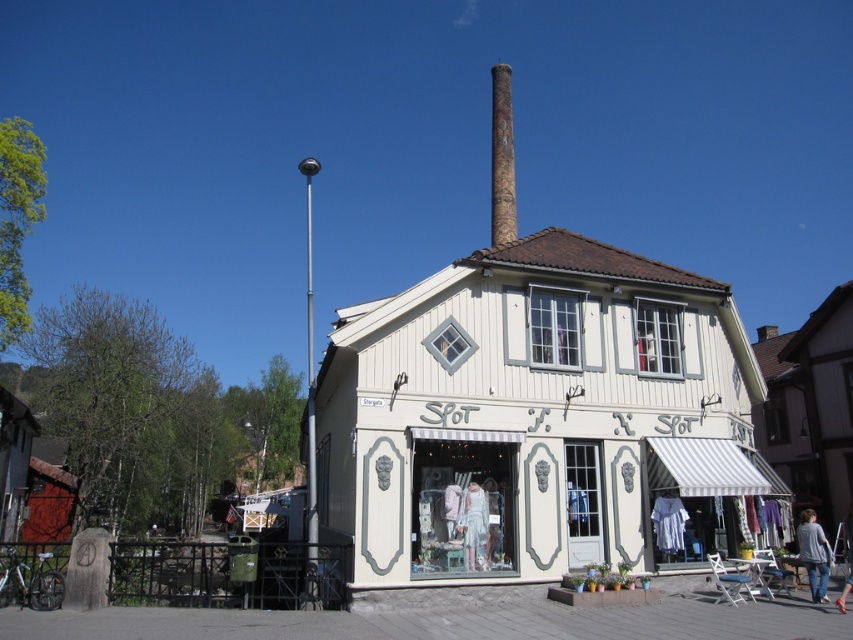
Does white wood storefront at center appear over gray sweater at lower right?

Yes, white wood storefront at center is above gray sweater at lower right.

Can you confirm if white wood storefront at center is taller than gray sweater at lower right?

Indeed, white wood storefront at center has a greater height compared to gray sweater at lower right.

Which is in front, point (322, 417) or point (817, 556)?

Positioned in front is point (817, 556).

I want to click on white wood storefront at center, so click(x=532, y=410).

Does point (491, 83) lie in front of point (457, 522)?

No, (491, 83) is further to viewer.

This screenshot has height=640, width=853. I want to click on rusty metal chimney at center, so click(x=502, y=157).

Which is more to the right, white fabric dress at center or gray sweater at lower right?

gray sweater at lower right

Does white fabric dress at center appear under gray sweater at lower right?

Incorrect, white fabric dress at center is not positioned below gray sweater at lower right.

This screenshot has width=853, height=640. What are the coordinates of `white fabric dress at center` in the screenshot? It's located at (473, 525).